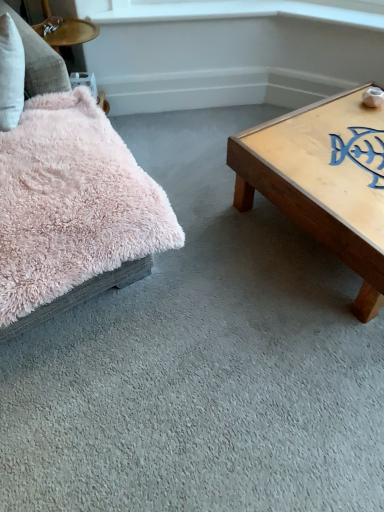
In order to click on free space above white glossy window sill at upper center (from a real-world perspective) in this screenshot , I will do `click(171, 7)`.